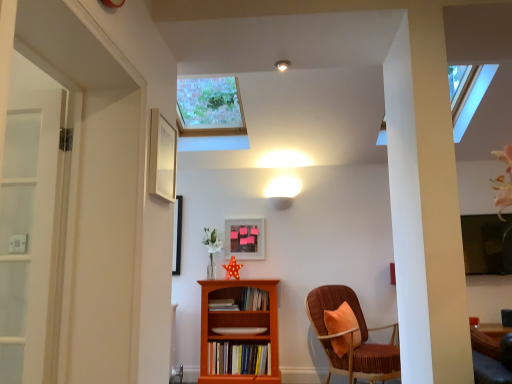
Where is `hardcover books at center, placed as the fourth book when sorted from top to bottom`? The width and height of the screenshot is (512, 384). hardcover books at center, placed as the fourth book when sorted from top to bottom is located at coordinates (238, 358).

What do you see at coordinates (238, 358) in the screenshot? The image size is (512, 384). I see `hardcover books at center, acting as the 1th book starting from the bottom` at bounding box center [238, 358].

What do you see at coordinates (162, 158) in the screenshot? This screenshot has height=384, width=512. I see `white matte picture frame at upper center, which is counted as the first picture frame, starting from the top` at bounding box center [162, 158].

You are a GUI agent. You are given a task and a screenshot of the screen. Output one action in this format:
    pyautogui.click(x=<x>, y=<y>)
    Task: Click on the matte wooden picture frame at center, the second picture frame positioned from the left
    
    Given the screenshot: What is the action you would take?
    pyautogui.click(x=244, y=239)

The height and width of the screenshot is (384, 512). What do you see at coordinates (361, 339) in the screenshot?
I see `velvet brown chair at right` at bounding box center [361, 339].

Based on the photo, in order to face velvet brown chair at right, should I rotate leftwards or rightwards?

To align with it, rotate right about 13.486°.

Describe the element at coordinates (254, 299) in the screenshot. I see `wooden bookshelf at center, marked as the 4th book in a bottom-to-top arrangement` at that location.

The image size is (512, 384). Find the location of `hardcover books at center, placed as the fourth book when sorted from top to bottom`. hardcover books at center, placed as the fourth book when sorted from top to bottom is located at coordinates point(238,358).

How much distance is there between wooden bookshelf at center, marked as the 4th book in a bottom-to-top arrangement, and white matte picture frame at upper center, which is the second picture frame from right to left?

6.89 feet.

Is the depth of wooden bookshelf at center, arranged as the 1th book when viewed from the top, less than that of white matte picture frame at upper center, which is the second picture frame from right to left?

That is False.

In the scene shown: Considering the relative positions of wooden bookshelf at center, arranged as the 1th book when viewed from the top, and white matte picture frame at upper center, which is counted as the first picture frame, starting from the top, in the image provided, is wooden bookshelf at center, arranged as the 1th book when viewed from the top, to the left of white matte picture frame at upper center, which is counted as the first picture frame, starting from the top, from the viewer's perspective?

Incorrect, wooden bookshelf at center, arranged as the 1th book when viewed from the top, is not on the left side of white matte picture frame at upper center, which is counted as the first picture frame, starting from the top.

From the image's perspective, is wooden bookshelf at center, marked as the 4th book in a bottom-to-top arrangement, on white matte picture frame at upper center, which ranks as the 1th picture frame in left-to-right order?

No, from the image's perspective, wooden bookshelf at center, marked as the 4th book in a bottom-to-top arrangement, is not above white matte picture frame at upper center, which ranks as the 1th picture frame in left-to-right order.

From the image's perspective, is matte wooden picture frame at center, placed as the 1th picture frame when sorted from right to left, above matte white book at center, acting as the 2th book starting from the bottom?

Yes.

Is matte wooden picture frame at center, which ranks as the first picture frame in bottom-to-top order, completely or partially outside of matte white book at center, acting as the 2th book starting from the bottom?

Yes.

Is the depth of matte wooden picture frame at center, placed as the 1th picture frame when sorted from right to left, greater than that of matte white book at center, acting as the 2th book starting from the bottom?

Yes, the depth of matte wooden picture frame at center, placed as the 1th picture frame when sorted from right to left, is greater than that of matte white book at center, acting as the 2th book starting from the bottom.

Is matte wooden picture frame at center, which ranks as the first picture frame in bottom-to-top order, positioned far away from wooden bookshelf at center, marked as the 4th book in a bottom-to-top arrangement?

That's not correct — matte wooden picture frame at center, which ranks as the first picture frame in bottom-to-top order, is a little close to wooden bookshelf at center, marked as the 4th book in a bottom-to-top arrangement.

Consider the image. Considering the relative positions of matte wooden picture frame at center, placed as the 1th picture frame when sorted from right to left, and wooden bookshelf at center, marked as the 4th book in a bottom-to-top arrangement, in the image provided, is matte wooden picture frame at center, placed as the 1th picture frame when sorted from right to left, behind wooden bookshelf at center, marked as the 4th book in a bottom-to-top arrangement,?

Yes, it is.

You are a GUI agent. You are given a task and a screenshot of the screen. Output one action in this format:
    pyautogui.click(x=<x>, y=<y>)
    Task: Click on the book on the right of matte wooden picture frame at center, the second picture frame positioned from the left
    
    Given the screenshot: What is the action you would take?
    pyautogui.click(x=254, y=299)

From the picture: Considering the relative positions of white matte picture frame at upper center, which ranks as the 1th picture frame in left-to-right order, and wooden bookshelf at center, marked as the 4th book in a bottom-to-top arrangement, in the image provided, is white matte picture frame at upper center, which ranks as the 1th picture frame in left-to-right order, in front of wooden bookshelf at center, marked as the 4th book in a bottom-to-top arrangement,?

Yes, white matte picture frame at upper center, which ranks as the 1th picture frame in left-to-right order, is in front of wooden bookshelf at center, marked as the 4th book in a bottom-to-top arrangement.

From the picture: Can you tell me how much white matte picture frame at upper center, which ranks as the 1th picture frame in left-to-right order, and wooden bookshelf at center, marked as the 4th book in a bottom-to-top arrangement, differ in facing direction?

white matte picture frame at upper center, which ranks as the 1th picture frame in left-to-right order, and wooden bookshelf at center, marked as the 4th book in a bottom-to-top arrangement, are facing 88.6 degrees away from each other.

Is white matte picture frame at upper center, which appears as the 2th picture frame when viewed from the back, oriented towards wooden bookshelf at center, arranged as the 1th book when viewed from the top?

No, white matte picture frame at upper center, which appears as the 2th picture frame when viewed from the back, is not turned towards wooden bookshelf at center, arranged as the 1th book when viewed from the top.

Is there a large distance between wooden book at center, which is the second book in top-to-bottom order, and matte white book at center, acting as the 2th book starting from the bottom?

No, wooden book at center, which is the second book in top-to-bottom order, is in close proximity to matte white book at center, acting as the 2th book starting from the bottom.

Would you say wooden book at center, which is the second book in top-to-bottom order, contains matte white book at center, acting as the 2th book starting from the bottom?

No, matte white book at center, acting as the 2th book starting from the bottom, is not inside wooden book at center, which is the second book in top-to-bottom order.

Looking at this image, is wooden book at center, which appears as the third book when ordered from the bottom, wider than matte white book at center, acting as the 2th book starting from the bottom?

Yes.

How far apart are wooden book at center, which is the second book in top-to-bottom order, and matte white book at center, acting as the 2th book starting from the bottom?

wooden book at center, which is the second book in top-to-bottom order, is 8.70 inches away from matte white book at center, acting as the 2th book starting from the bottom.

Between matte white book at center, the 3th book from the top, and orange wood bookcase at center, which one has smaller width?

With smaller width is matte white book at center, the 3th book from the top.

Is matte white book at center, acting as the 2th book starting from the bottom, in front of or behind orange wood bookcase at center in the image?

Visually, matte white book at center, acting as the 2th book starting from the bottom, is located behind orange wood bookcase at center.

Is point (213, 332) positioned after point (246, 321)?

No, it is in front of (246, 321).

From a real-world perspective, who is located higher, matte white book at center, acting as the 2th book starting from the bottom, or orange wood bookcase at center?

From a 3D spatial view, matte white book at center, acting as the 2th book starting from the bottom, is above.

From the image's perspective, who appears lower, matte wooden picture frame at center, the second picture frame positioned from the left, or hardcover books at center, acting as the 1th book starting from the bottom?

From the image's view, hardcover books at center, acting as the 1th book starting from the bottom, is below.

At what (x,y) coordinates should I click in order to perform the action: click on picture frame behind the hardcover books at center, acting as the 1th book starting from the bottom. Please return your answer as a coordinate pair (x, y). Looking at the image, I should click on (244, 239).

Is matte wooden picture frame at center, the 2th picture frame positioned from the front, at the right side of hardcover books at center, placed as the fourth book when sorted from top to bottom?

Indeed, matte wooden picture frame at center, the 2th picture frame positioned from the front, is positioned on the right side of hardcover books at center, placed as the fourth book when sorted from top to bottom.

Considering the points (254, 241) and (253, 364), which point is in front, point (254, 241) or point (253, 364)?

The point (253, 364) is more forward.

From the wooden bookshelf at center, arranged as the 1th book when viewed from the top, count the 2nd picture frame to the left and point to it. Please provide its 2D coordinates.

[(162, 158)]

This screenshot has width=512, height=384. What are the coordinates of `picture frame to the right of matte white book at center, the 3th book from the top` in the screenshot? It's located at (244, 239).

Considering their positions, is hardcover books at center, acting as the 1th book starting from the bottom, positioned closer to matte wooden picture frame at center, the second picture frame positioned from the left, than velvet brown chair at right?

hardcover books at center, acting as the 1th book starting from the bottom.

Which object lies further to the anchor point white matte picture frame at upper center, which ranks as the 1th picture frame in left-to-right order, matte white ceiling light at upper center or wooden book at center, which is the second book in top-to-bottom order?

The object further to white matte picture frame at upper center, which ranks as the 1th picture frame in left-to-right order, is wooden book at center, which is the second book in top-to-bottom order.

When comparing their distances from wooden bookshelf at center, arranged as the 1th book when viewed from the top, does velvet brown chair at right or wooden book at center, which appears as the third book when ordered from the bottom, seem further?

The object further to wooden bookshelf at center, arranged as the 1th book when viewed from the top, is velvet brown chair at right.

From the image, which object appears to be nearer to orange wood bookcase at center, wooden book at center, which is the second book in top-to-bottom order, or wooden bookshelf at center, marked as the 4th book in a bottom-to-top arrangement?

Based on the image, wooden bookshelf at center, marked as the 4th book in a bottom-to-top arrangement, appears to be nearer to orange wood bookcase at center.

When comparing their distances from hardcover books at center, placed as the fourth book when sorted from top to bottom, does matte white book at center, acting as the 2th book starting from the bottom, or wooden bookshelf at center, arranged as the 1th book when viewed from the top, seem closer?

Among the two, matte white book at center, acting as the 2th book starting from the bottom, is located nearer to hardcover books at center, placed as the fourth book when sorted from top to bottom.

Based on their spatial positions, is matte white book at center, the 3th book from the top, or matte white ceiling light at upper center further from velvet brown chair at right?

Based on the image, matte white ceiling light at upper center appears to be further to velvet brown chair at right.

From the picture: From the image, which object appears to be nearer to velvet brown chair at right, hardcover books at center, placed as the fourth book when sorted from top to bottom, or matte white book at center, acting as the 2th book starting from the bottom?

Based on the image, hardcover books at center, placed as the fourth book when sorted from top to bottom, appears to be nearer to velvet brown chair at right.

When comparing their distances from orange wood bookcase at center, does matte white ceiling light at upper center or hardcover books at center, placed as the fourth book when sorted from top to bottom, seem further?

The object further to orange wood bookcase at center is matte white ceiling light at upper center.

Locate an element on the screen. Image resolution: width=512 pixels, height=384 pixels. book located between hardcover books at center, acting as the 1th book starting from the bottom, and velvet brown chair at right in the left-right direction is located at coordinates (254, 299).

You are a GUI agent. You are given a task and a screenshot of the screen. Output one action in this format:
    pyautogui.click(x=<x>, y=<y>)
    Task: Click on the chair between matte white ceiling light at upper center and orange wood bookcase at center in the up-down direction
    Image resolution: width=512 pixels, height=384 pixels.
    Given the screenshot: What is the action you would take?
    pyautogui.click(x=361, y=339)

The image size is (512, 384). Identify the location of bookcase between wooden book at center, which is the second book in top-to-bottom order, and hardcover books at center, acting as the 1th book starting from the bottom, in the up-down direction. (239, 326).

Find the location of a particular element. Image resolution: width=512 pixels, height=384 pixels. book between orange wood bookcase at center and hardcover books at center, acting as the 1th book starting from the bottom, in the up-down direction is located at coordinates (239, 330).